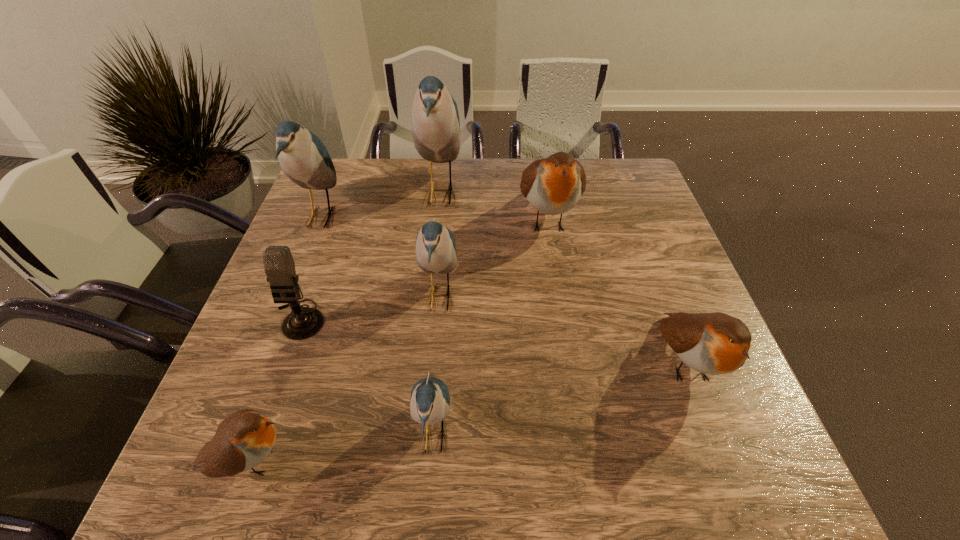
Point out which object is positioned as the fifth nearest to the rightmost brown bird. Please provide its 2D coordinates. Your answer should be formatted as a tuple, i.e. [(x, y)], where the tuple contains the x and y coordinates of a point satisfying the conditions above.

[(244, 439)]

Locate an element on the screen. This screenshot has width=960, height=540. object that is the fifth nearest to the smallest blue bird is located at coordinates (553, 185).

Locate an element on the screen. Image resolution: width=960 pixels, height=540 pixels. the fourth closest bird relative to the second nearest blue bird is located at coordinates [x=303, y=157].

Identify which bird is the fifth closest to the microphone. Please provide its 2D coordinates. Your answer should be formatted as a tuple, i.e. [(x, y)], where the tuple contains the x and y coordinates of a point satisfying the conditions above.

[(435, 119)]

Locate an element on the screen. Image resolution: width=960 pixels, height=540 pixels. blue bird that is the closest to the smallest blue bird is located at coordinates (435, 253).

Identify which blue bird is the nearest to the second biggest blue bird. Please provide its 2D coordinates. Your answer should be formatted as a tuple, i.e. [(x, y)], where the tuple contains the x and y coordinates of a point satisfying the conditions above.

[(435, 119)]

Identify the location of brown bird that is the closest to the smallest blue bird. (244, 439).

Identify which brown bird is located as the second nearest to the smallest brown bird. Please provide its 2D coordinates. Your answer should be formatted as a tuple, i.e. [(x, y)], where the tuple contains the x and y coordinates of a point satisfying the conditions above.

[(715, 343)]

The image size is (960, 540). What are the coordinates of `free point that satisfies the following two spatial constraints: 1. at the face of the farthest brown bird; 2. at the face of the leftmost brown bird` in the screenshot? It's located at (588, 461).

You are a GUI agent. You are given a task and a screenshot of the screen. Output one action in this format:
    pyautogui.click(x=<x>, y=<y>)
    Task: Click on the vacant area that satisfies the following two spatial constraints: 1. at the face of the rightmost object; 2. at the tip of the nearest blue bird's beak
    Image resolution: width=960 pixels, height=540 pixels.
    Given the screenshot: What is the action you would take?
    pyautogui.click(x=713, y=435)